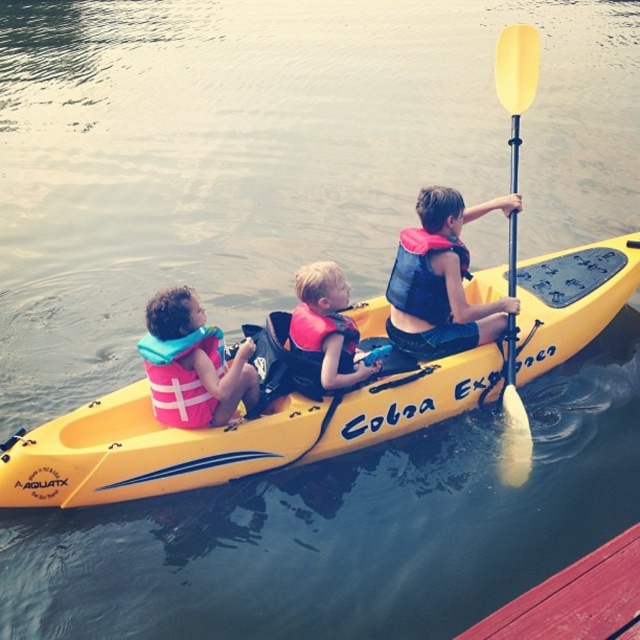
Question: Considering the real-world distances, which object is closest to the pink life jacket at center?

Choices:
 (A) blue life vest at center
 (B) pink life vest at center

Answer: (B)

Question: From the image, what is the correct spatial relationship of yellow plastic canoe at center in relation to blue fabric life jacket at rear?

Choices:
 (A) below
 (B) above

Answer: (A)

Question: Which of the following is the closest to the observer?

Choices:
 (A) yellow matte paddle at upper right
 (B) yellow plastic canoe at center
 (C) pink life jacket at center
 (D) pink life vest at center

Answer: (B)

Question: Does yellow matte paddle at upper right have a smaller size compared to pink life jacket at center?

Choices:
 (A) no
 (B) yes

Answer: (B)

Question: Does blue fabric life jacket at rear have a greater width compared to pink life jacket at center?

Choices:
 (A) yes
 (B) no

Answer: (A)

Question: Estimate the real-world distances between objects in this image. Which object is closer to the yellow plastic canoe at center?

Choices:
 (A) blue life vest at center
 (B) blue fabric life jacket at rear

Answer: (A)